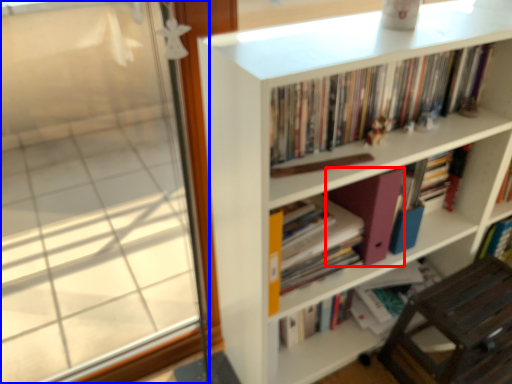
Question: Which point is further to the camera, paperback book (highlighted by a red box) or window (highlighted by a blue box)?

Choices:
 (A) paperback book
 (B) window

Answer: (A)